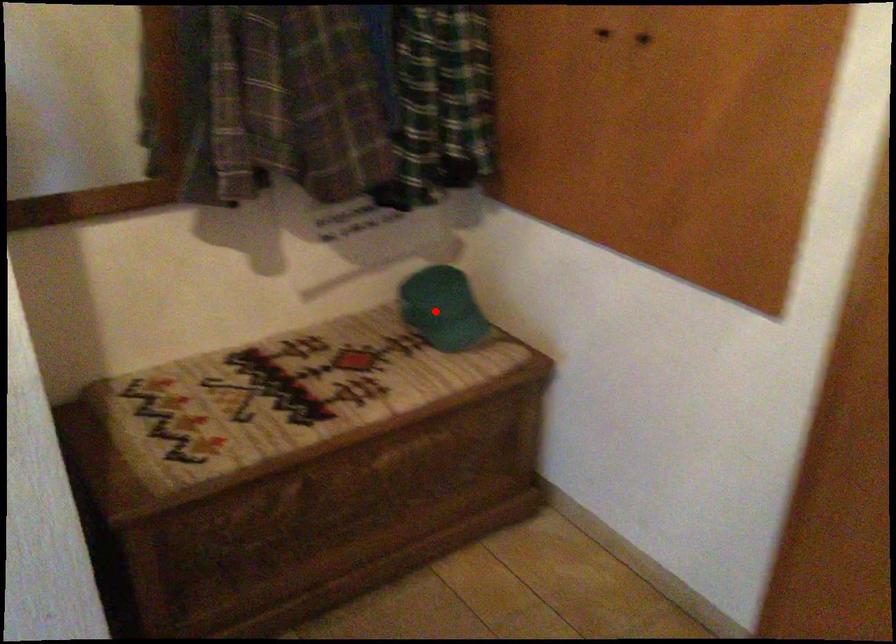
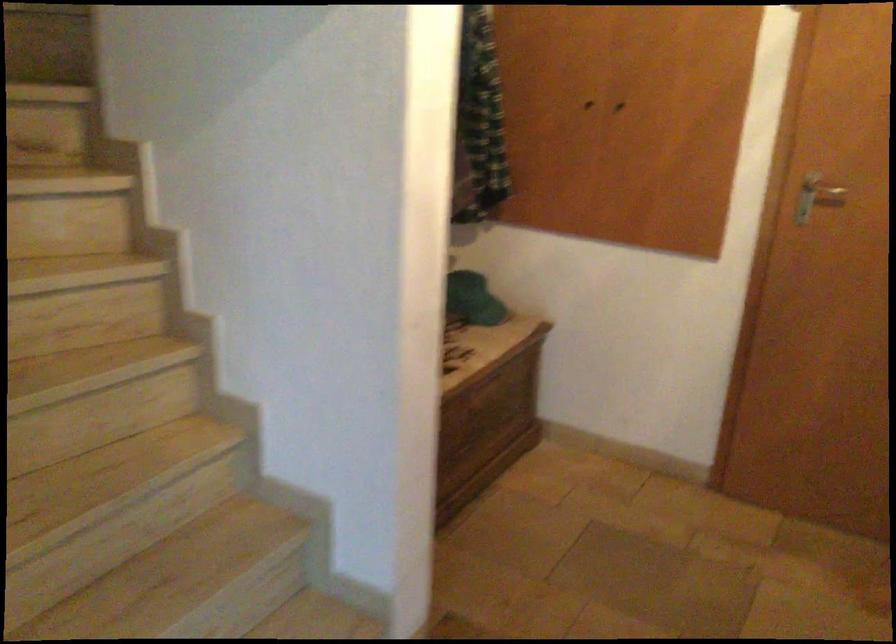
Question: I am providing you with two images of the same scene from different viewpoints. Image1 has a red point marked. In image2, the corresponding 3D location appears at what relative position? Reply with the corresponding letter.

Choices:
 (A) Closer
 (B) Farther

Answer: (B)